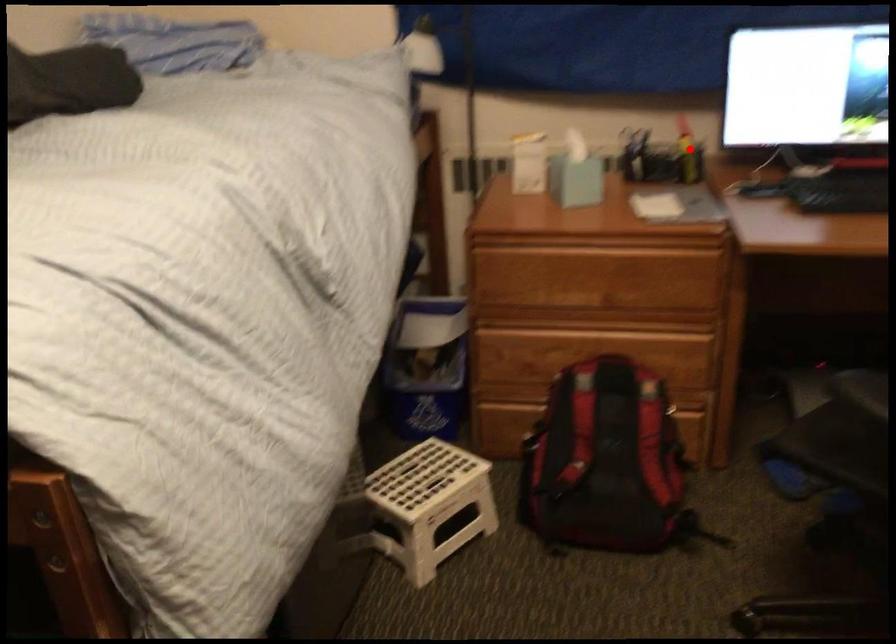
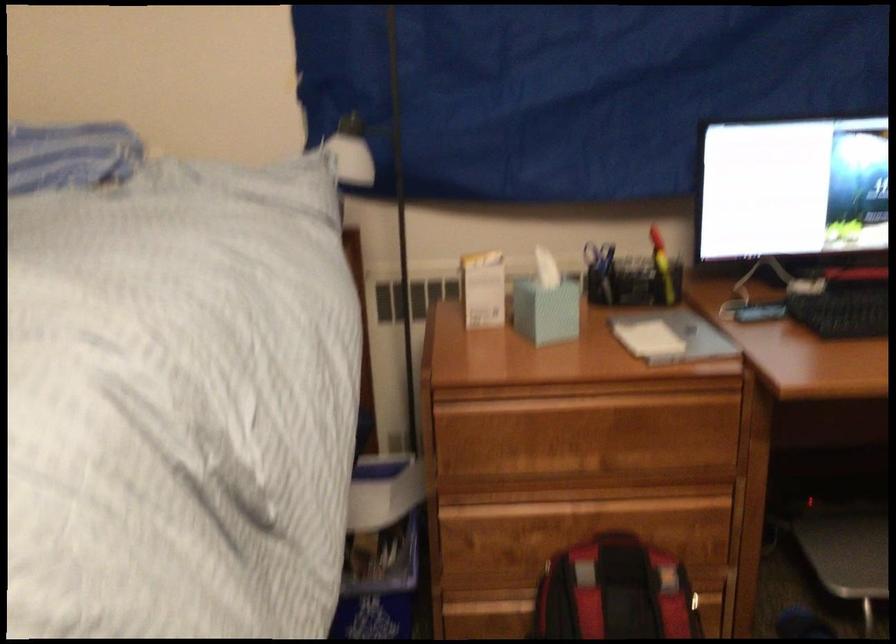
The point at the highlighted location is marked in the first image. Where is the corresponding point in the second image?

(662, 267)